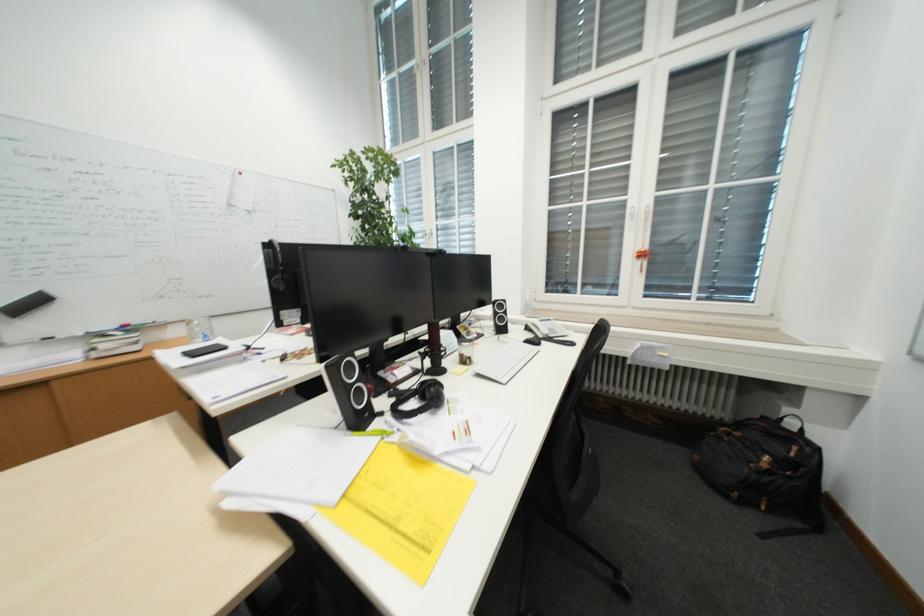
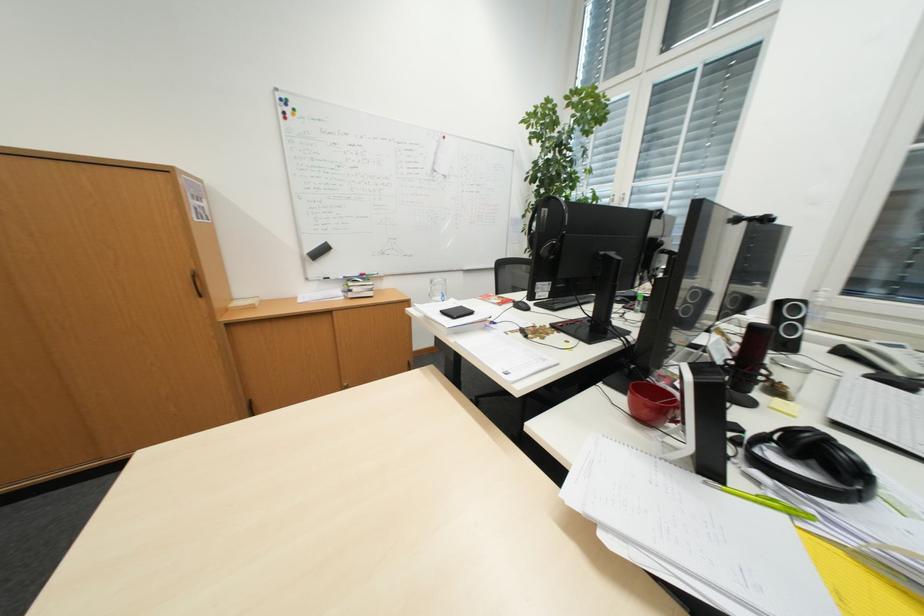
Question: What movement of the cameraman would produce the second image?

Choices:
 (A) Left
 (B) Right
 (C) Forward
 (D) Backward

Answer: (A)